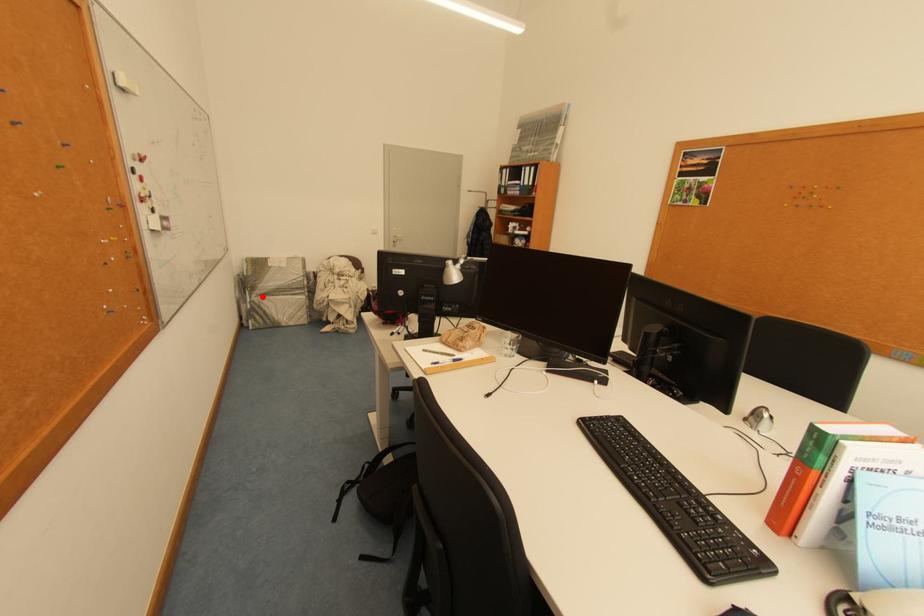
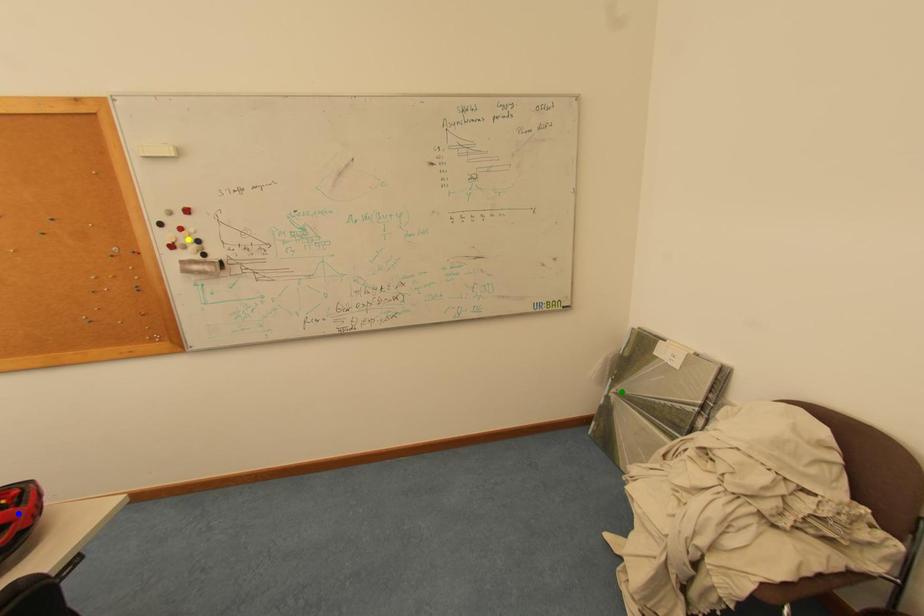
Question: I am providing you with two images of the same scene from different viewpoints. A red point is marked on the first image. You are given multiple points on the second image. Which point in image 2 is actually the same real-world point as the red point in image 1?

Choices:
 (A) yellow point
 (B) blue point
 (C) green point

Answer: (C)